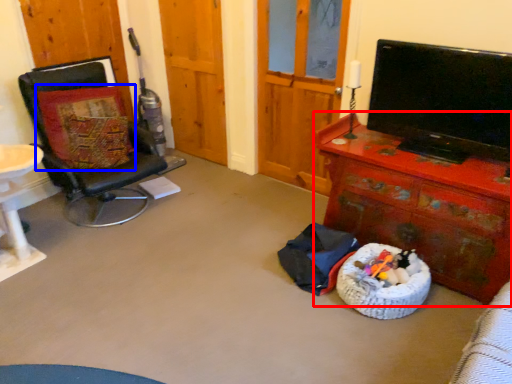
Question: Which of the following is the closest to the observer, desk (highlighted by a red box) or pillow (highlighted by a blue box)?

Choices:
 (A) desk
 (B) pillow

Answer: (A)